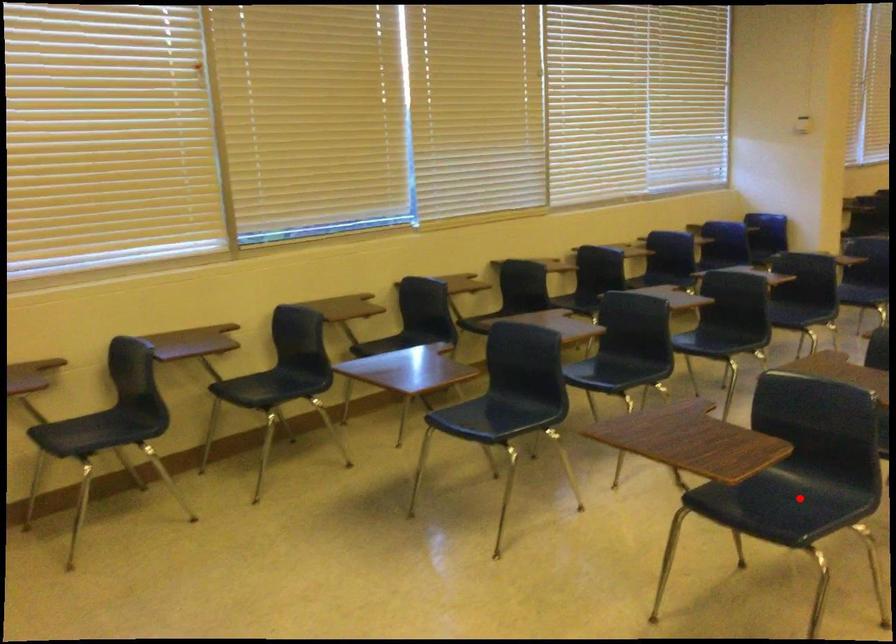
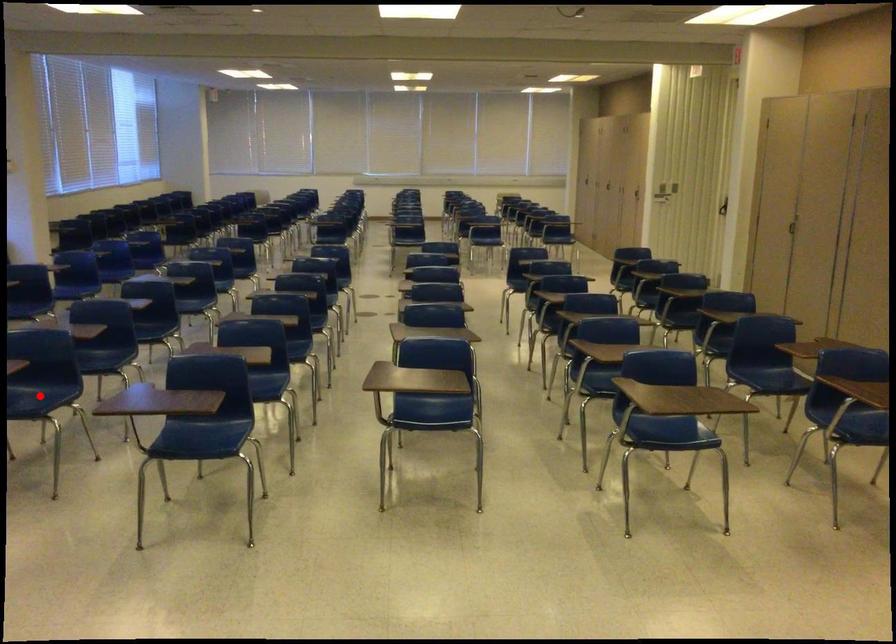
I am providing you with two images of the same scene from different viewpoints. A red point is marked on the first image and another point is marked on the second image. Is the marked point in image1 the same physical position as the marked point in image2?

Yes